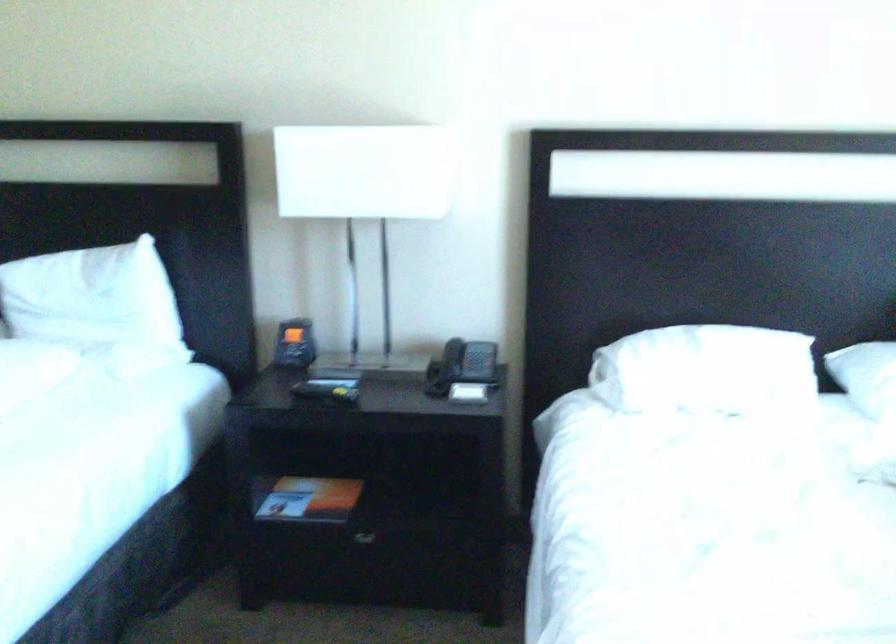
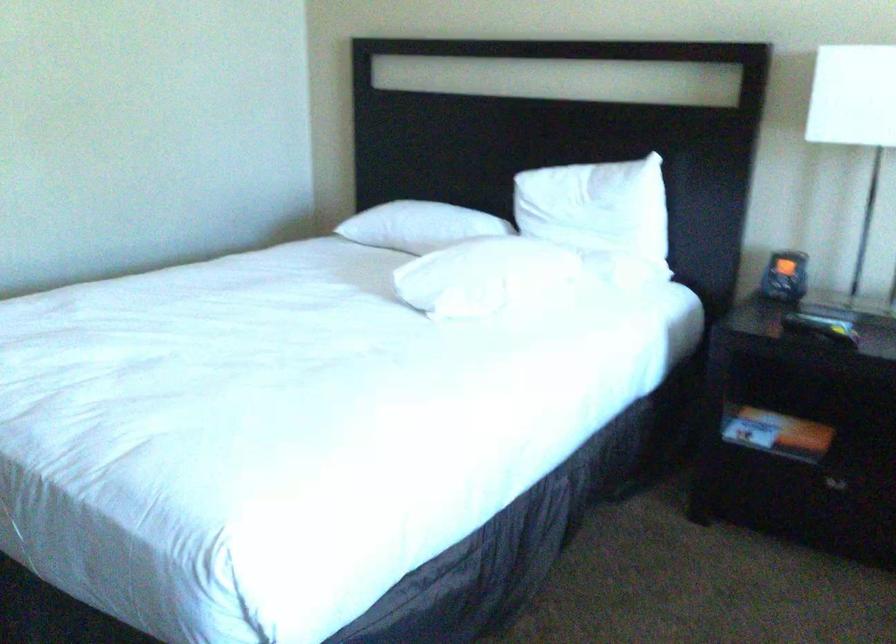
Question: The camera is either moving clockwise (left) or counter-clockwise (right) around the object. The first image is from the beginning of the video and the second image is from the end. Is the camera moving left or right when shooting the video?

Choices:
 (A) Left
 (B) Right

Answer: (B)